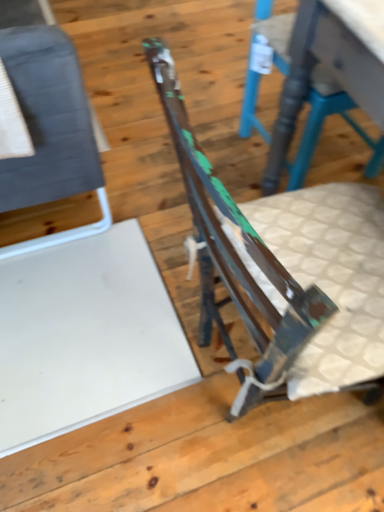
Question: Is point (327, 313) positioned closer to the camera than point (34, 185)?

Choices:
 (A) closer
 (B) farther

Answer: (A)

Question: Would you say rusty metal chair at center, positioned as the 2th chair in left-to-right order, is inside or outside matte gray fabric chair at left, which is the first chair from left to right?

Choices:
 (A) inside
 (B) outside

Answer: (B)

Question: Estimate the real-world distances between objects in this image. Which object is farther from the rusty metal chair at center, placed as the 2th chair when sorted from right to left?

Choices:
 (A) matte gray fabric chair at left, which is the first chair from left to right
 (B) rustic wood chair at center, arranged as the 3th chair when viewed from the left

Answer: (B)

Question: Estimate the real-world distances between objects in this image. Which object is closer to the rusty metal chair at center, placed as the 2th chair when sorted from right to left?

Choices:
 (A) matte gray fabric chair at left, which is the first chair from left to right
 (B) rustic wood chair at center, which is the 1th chair from right to left

Answer: (A)